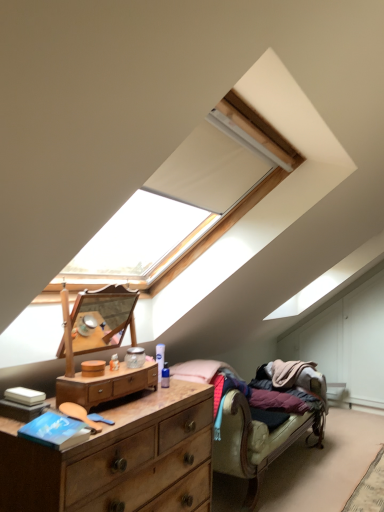
Question: Considering the relative sizes of wooden dresser at center, which is the second chest of drawers in bottom-to-top order, and wooden studio couch at lower right in the image provided, is wooden dresser at center, which is the second chest of drawers in bottom-to-top order, thinner than wooden studio couch at lower right?

Choices:
 (A) yes
 (B) no

Answer: (A)

Question: Can you confirm if wooden dresser at center, acting as the 1th chest of drawers starting from the top, is shorter than wooden studio couch at lower right?

Choices:
 (A) no
 (B) yes

Answer: (B)

Question: From the image's perspective, is wooden dresser at center, which is the second chest of drawers in bottom-to-top order, on wooden studio couch at lower right?

Choices:
 (A) yes
 (B) no

Answer: (A)

Question: Is wooden dresser at center, which is the second chest of drawers in bottom-to-top order, taller than wooden studio couch at lower right?

Choices:
 (A) no
 (B) yes

Answer: (A)

Question: From a real-world perspective, is wooden dresser at center, acting as the 1th chest of drawers starting from the top, below wooden studio couch at lower right?

Choices:
 (A) no
 (B) yes

Answer: (A)

Question: From a real-world perspective, is wooden dresser at center, which is the second chest of drawers in bottom-to-top order, above or below wooden dresser at lower left, acting as the first chest of drawers starting from the bottom?

Choices:
 (A) above
 (B) below

Answer: (A)

Question: Considering the relative positions of wooden dresser at center, which is the second chest of drawers in bottom-to-top order, and wooden dresser at lower left, which is counted as the second chest of drawers, starting from the top, in the image provided, is wooden dresser at center, which is the second chest of drawers in bottom-to-top order, to the left or to the right of wooden dresser at lower left, which is counted as the second chest of drawers, starting from the top,?

Choices:
 (A) right
 (B) left

Answer: (A)

Question: Looking at their shapes, would you say wooden dresser at center, which is the second chest of drawers in bottom-to-top order, is wider or thinner than wooden dresser at lower left, acting as the first chest of drawers starting from the bottom?

Choices:
 (A) wide
 (B) thin

Answer: (B)

Question: Considering their positions, is wooden dresser at center, acting as the 1th chest of drawers starting from the top, located in front of or behind wooden dresser at lower left, which is counted as the second chest of drawers, starting from the top?

Choices:
 (A) front
 (B) behind

Answer: (B)

Question: Does point (249, 473) appear closer or farther from the camera than point (71, 397)?

Choices:
 (A) farther
 (B) closer

Answer: (A)

Question: Is wooden studio couch at lower right taller or shorter than wooden dresser at center, acting as the 1th chest of drawers starting from the top?

Choices:
 (A) short
 (B) tall

Answer: (B)

Question: From a real-world perspective, is wooden studio couch at lower right above or below wooden dresser at center, which is the second chest of drawers in bottom-to-top order?

Choices:
 (A) below
 (B) above

Answer: (A)

Question: Considering the positions of wooden studio couch at lower right and wooden dresser at center, which is the second chest of drawers in bottom-to-top order, in the image, is wooden studio couch at lower right wider or thinner than wooden dresser at center, which is the second chest of drawers in bottom-to-top order,?

Choices:
 (A) thin
 (B) wide

Answer: (B)

Question: Based on their sizes in the image, would you say wooden studio couch at lower right is bigger or smaller than wooden dresser at lower left, acting as the first chest of drawers starting from the bottom?

Choices:
 (A) big
 (B) small

Answer: (A)

Question: Is point (266, 446) closer or farther from the camera than point (72, 502)?

Choices:
 (A) farther
 (B) closer

Answer: (A)